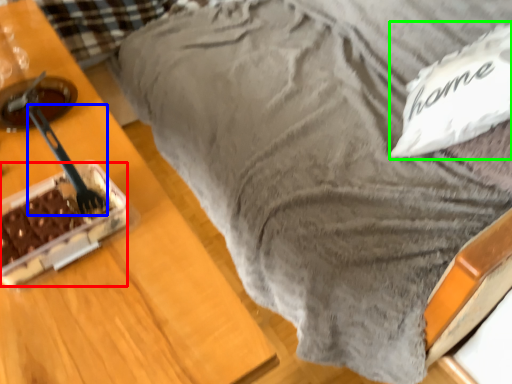
Question: Considering the real-world distances, which object is closest to cake (highlighted by a red box)? utensil (highlighted by a blue box) or pillow (highlighted by a green box).

Choices:
 (A) utensil
 (B) pillow

Answer: (A)